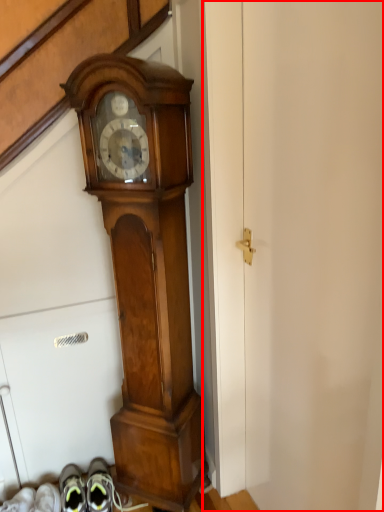
Question: From the image's perspective, where is door (annotated by the red box) located in relation to wall clock in the image?

Choices:
 (A) above
 (B) below

Answer: (B)